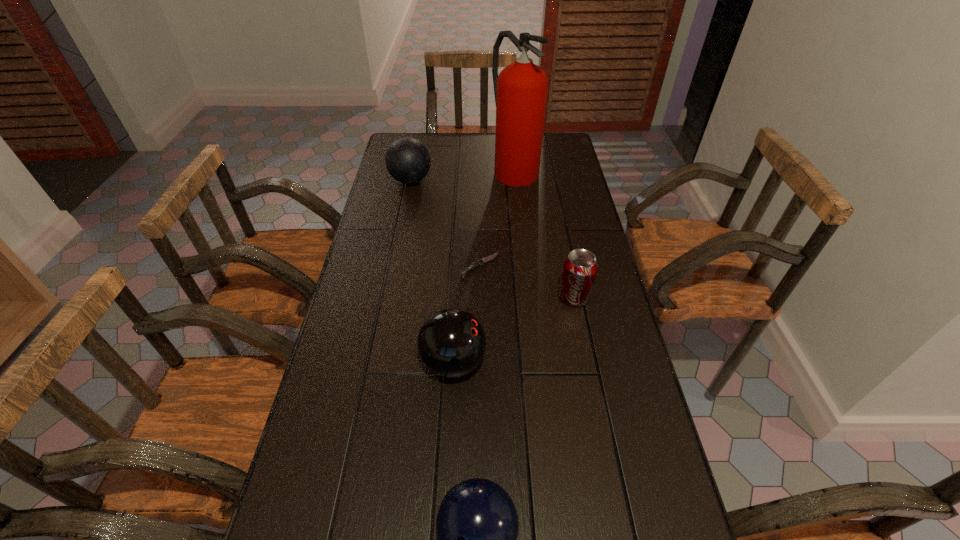
Locate an element on the screen. This screenshot has width=960, height=540. free point at the far right corner is located at coordinates (568, 136).

The height and width of the screenshot is (540, 960). In order to click on blank region between the farthest bowling ball and the soda can in this screenshot , I will do `click(492, 239)`.

Identify the location of blank region between the fire extinguisher and the second nearest bowling ball. point(484,265).

Locate an element on the screen. The width and height of the screenshot is (960, 540). vacant area that lies between the soda can and the second farthest bowling ball is located at coordinates (514, 329).

The image size is (960, 540). What are the coordinates of `free area in between the soda can and the second nearest bowling ball` in the screenshot? It's located at (514, 329).

Locate an element on the screen. The height and width of the screenshot is (540, 960). free area in between the second farthest bowling ball and the leftmost object is located at coordinates (432, 272).

Identify the location of object that is the third closest to the nearest object. (481, 262).

Identify the location of the fourth closest object to the farthest bowling ball. The height and width of the screenshot is (540, 960). (451, 343).

Choose which bowling ball is the nearest neighbor to the tallest object. Please provide its 2D coordinates. Your answer should be formatted as a tuple, i.e. [(x, y)], where the tuple contains the x and y coordinates of a point satisfying the conditions above.

[(407, 159)]

The width and height of the screenshot is (960, 540). I want to click on the closest bowling ball to the nearest object, so click(x=451, y=343).